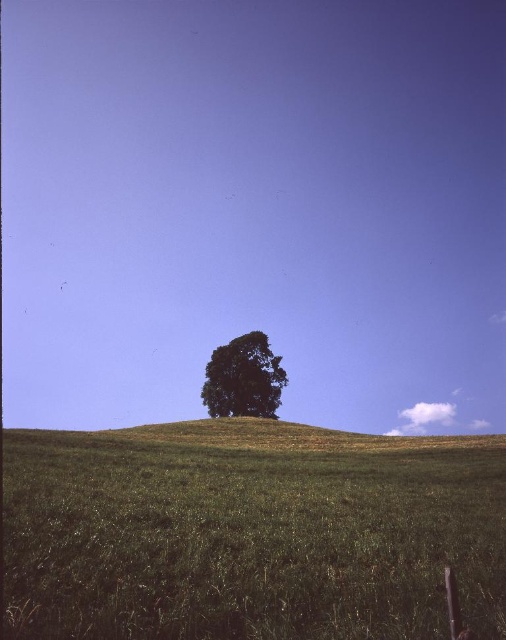
Question: Can you confirm if green grassy hill at center is positioned below green leafy tree at center?

Choices:
 (A) no
 (B) yes

Answer: (A)

Question: Which object is closer to the camera taking this photo?

Choices:
 (A) green grassy hill at center
 (B) green leafy tree at center

Answer: (A)

Question: Which point appears farthest from the camera in this image?

Choices:
 (A) (224, 412)
 (B) (197, 524)

Answer: (A)

Question: Is green grassy hill at center wider than green leafy tree at center?

Choices:
 (A) yes
 (B) no

Answer: (A)

Question: Is green grassy hill at center to the left of green leafy tree at center from the viewer's perspective?

Choices:
 (A) no
 (B) yes

Answer: (A)

Question: Which point is closer to the camera taking this photo?

Choices:
 (A) (388, 566)
 (B) (230, 396)

Answer: (A)